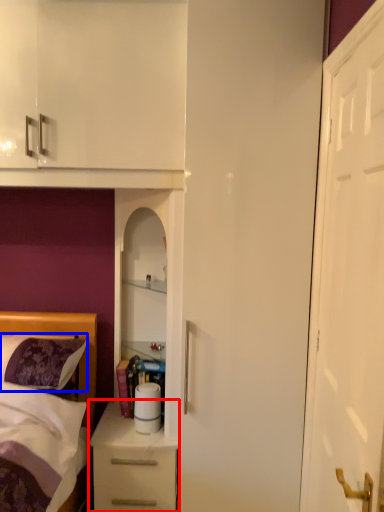
Question: Which of the following is the closest to the observer, chest of drawers (highlighted by a red box) or pillow (highlighted by a blue box)?

Choices:
 (A) chest of drawers
 (B) pillow

Answer: (B)